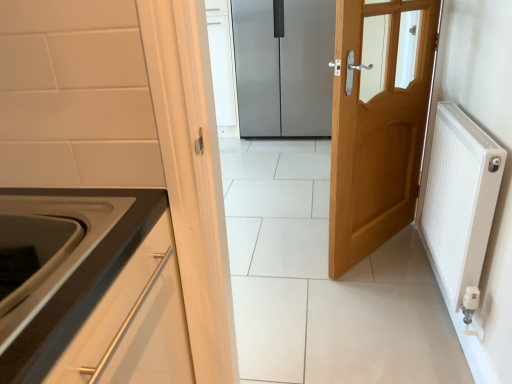
Question: Is white ribbed radiator at right taller than light wood door at center, acting as the first door starting from the front?

Choices:
 (A) no
 (B) yes

Answer: (A)

Question: Is white ribbed radiator at right positioned before light wood door at center, acting as the first door starting from the front?

Choices:
 (A) yes
 (B) no

Answer: (A)

Question: Is white ribbed radiator at right not near light wood door at center, the second door when ordered from back to front?

Choices:
 (A) yes
 (B) no

Answer: (B)

Question: From the image's perspective, is white ribbed radiator at right below light wood door at center, acting as the first door starting from the front?

Choices:
 (A) no
 (B) yes

Answer: (B)

Question: Is white ribbed radiator at right outside light wood door at center, acting as the first door starting from the front?

Choices:
 (A) yes
 (B) no

Answer: (A)

Question: Considering their positions, is white ribbed radiator at right located in front of or behind satin silver refrigerator at center, the first door from the back?

Choices:
 (A) behind
 (B) front

Answer: (B)

Question: Considering the positions of white ribbed radiator at right and satin silver refrigerator at center, the first door from the back, in the image, is white ribbed radiator at right taller or shorter than satin silver refrigerator at center, the first door from the back,?

Choices:
 (A) short
 (B) tall

Answer: (A)

Question: From a real-world perspective, is white ribbed radiator at right above or below satin silver refrigerator at center, the first door from the back?

Choices:
 (A) below
 (B) above

Answer: (A)

Question: Is white ribbed radiator at right bigger or smaller than satin silver refrigerator at center, the first door from the back?

Choices:
 (A) small
 (B) big

Answer: (A)

Question: Considering the positions of satin silver refrigerator at center, the first door from the back, and white glossy oven at lower left in the image, is satin silver refrigerator at center, the first door from the back, wider or thinner than white glossy oven at lower left?

Choices:
 (A) thin
 (B) wide

Answer: (B)

Question: From a real-world perspective, is satin silver refrigerator at center, the first door from the back, above or below white glossy oven at lower left?

Choices:
 (A) below
 (B) above

Answer: (A)

Question: In the image, is satin silver refrigerator at center, the first door from the back, on the left side or the right side of white glossy oven at lower left?

Choices:
 (A) right
 (B) left

Answer: (A)

Question: Does point (284, 41) appear closer or farther from the camera than point (111, 210)?

Choices:
 (A) closer
 (B) farther

Answer: (B)

Question: Looking at the image, does white ribbed radiator at right seem bigger or smaller compared to light wood door at center, acting as the first door starting from the front?

Choices:
 (A) small
 (B) big

Answer: (A)

Question: From a real-world perspective, is white ribbed radiator at right positioned above or below light wood door at center, acting as the first door starting from the front?

Choices:
 (A) above
 (B) below

Answer: (B)